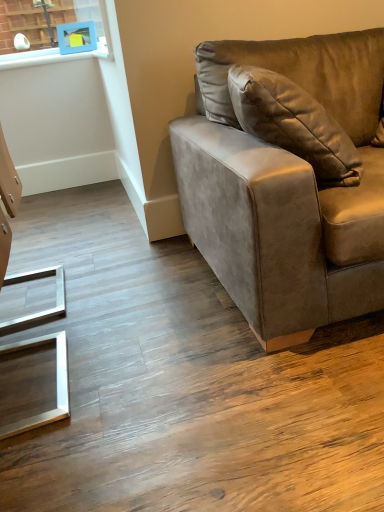
The width and height of the screenshot is (384, 512). I want to click on free space above blue plastic picture frame at upper left (from a real-world perspective), so click(74, 17).